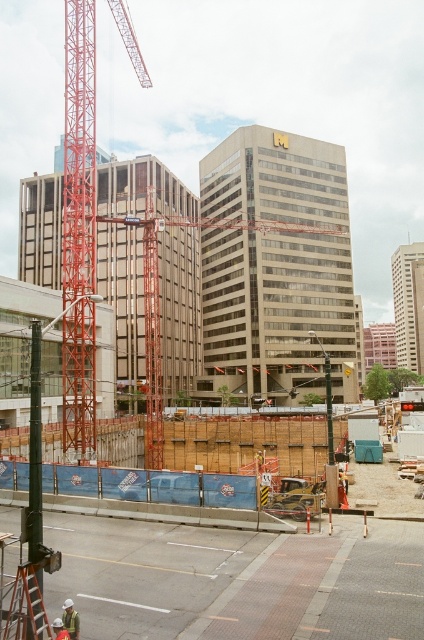
Question: Among these objects, which one is nearest to the camera?

Choices:
 (A) brown wooden fence at center
 (B) white hard hat at lower left
 (C) orange metallic crane at center
 (D) red painted metal tower crane at left

Answer: (B)

Question: Is orange metallic crane at center positioned at the back of white hard hat at lower left?

Choices:
 (A) no
 (B) yes

Answer: (B)

Question: Which of these objects is positioned closest to the orange metallic crane at center?

Choices:
 (A) white hard hat at lower left
 (B) red painted metal tower crane at left

Answer: (B)

Question: Can you confirm if orange metallic crane at center is positioned below white hard hat at lower left?

Choices:
 (A) yes
 (B) no

Answer: (B)

Question: Which point is farther to the camera?

Choices:
 (A) (306, 596)
 (B) (86, 262)
 (C) (70, 228)

Answer: (B)

Question: Is brown wooden fence at center wider than white hard hat at lower left?

Choices:
 (A) yes
 (B) no

Answer: (A)